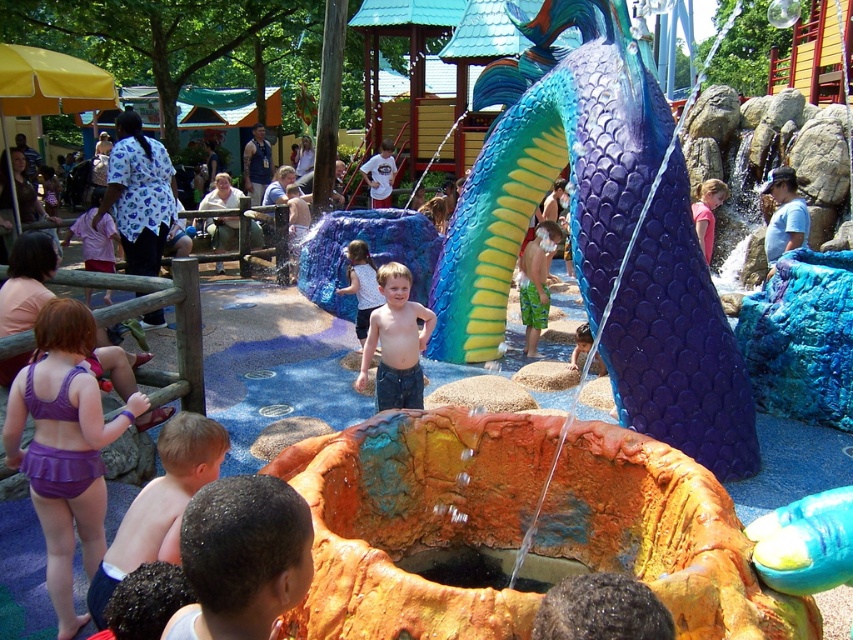
Question: Considering the relative positions of purple fabric swimsuit at lower left and shiny black hair at center in the image provided, where is purple fabric swimsuit at lower left located with respect to shiny black hair at center?

Choices:
 (A) right
 (B) left

Answer: (B)

Question: Is purple fabric swimsuit at lower left below smooth purple shorts at lower left?

Choices:
 (A) yes
 (B) no

Answer: (B)

Question: Which object is closer to the camera taking this photo?

Choices:
 (A) shiny blue shorts at center
 (B) shiny blue scales at center

Answer: (B)

Question: Which point is closer to the camera?

Choices:
 (A) click(x=355, y=291)
 (B) click(x=167, y=518)

Answer: (B)

Question: Among these objects, which one is farthest from the camera?

Choices:
 (A) shiny black hair at center
 (B) smooth purple shorts at lower left

Answer: (B)

Question: Does purple fabric swimsuit at lower left appear over shiny blue shorts at center?

Choices:
 (A) yes
 (B) no

Answer: (B)